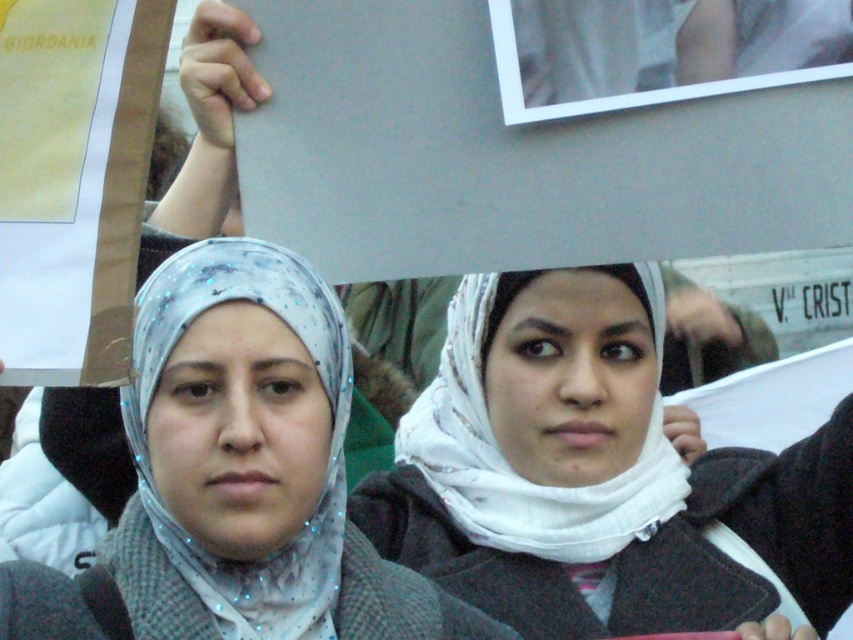
Can you confirm if white fabric headscarf at center is bigger than matte gray scarf at center?

Yes, white fabric headscarf at center is bigger than matte gray scarf at center.

Can you confirm if white fabric headscarf at center is positioned above matte gray scarf at center?

Indeed, white fabric headscarf at center is positioned over matte gray scarf at center.

The width and height of the screenshot is (853, 640). Find the location of `white fabric headscarf at center`. white fabric headscarf at center is located at coordinates (596, 476).

Locate an element on the screen. The height and width of the screenshot is (640, 853). white fabric headscarf at center is located at coordinates (596, 476).